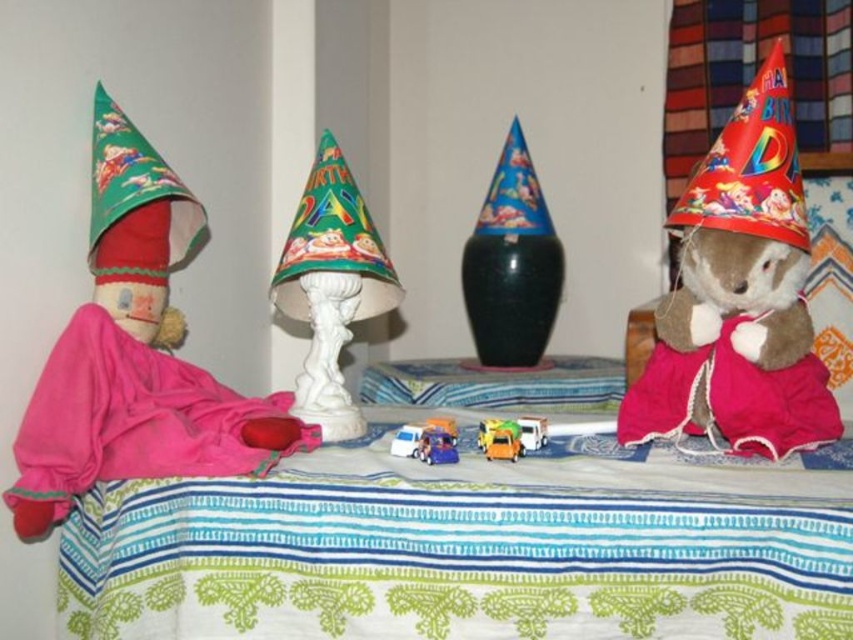
You are a guest at a party and want to pick up the shiny red paper party hat at right and the fuzzy brown teddy bear at right. Which object is closer to you?

The fuzzy brown teddy bear at right is closer to you because the shiny red paper party hat at right is behind it.

You are a guest at a party and see the pink fabric bed at lower left and the shiny red paper party hat at right. Which object is positioned lower on the table?

The pink fabric bed at lower left is positioned lower on the table than the shiny red paper party hat at right.

You are planning to place a new toy on the table but want to ensure it fits without overcrowding. Given the presence of the metallic blue truck at center and the white plastic toy truck at center, which truck should you choose to remove to make more space?

You should remove the white plastic toy truck at center because it occupies more space than the metallic blue truck at center, freeing up more room for the new toy.